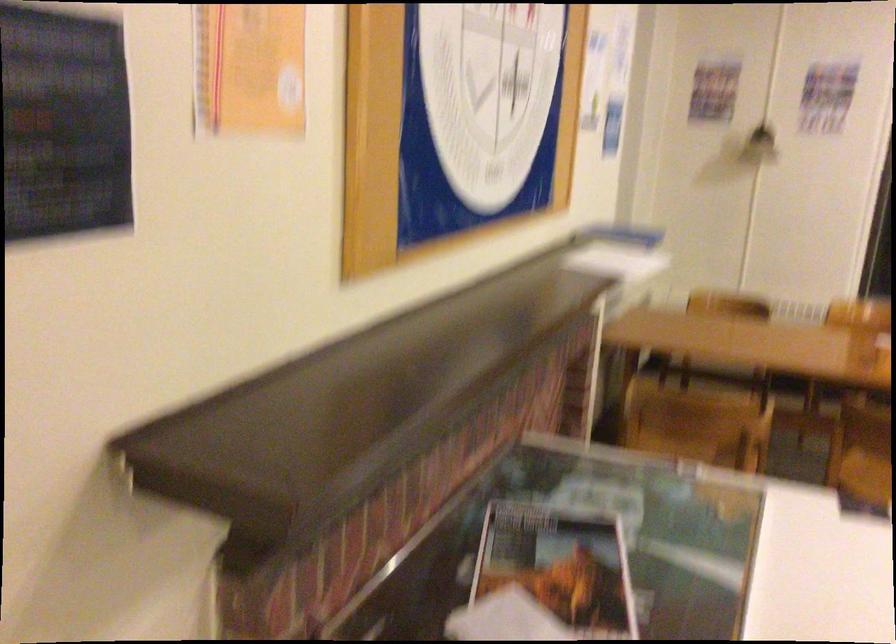
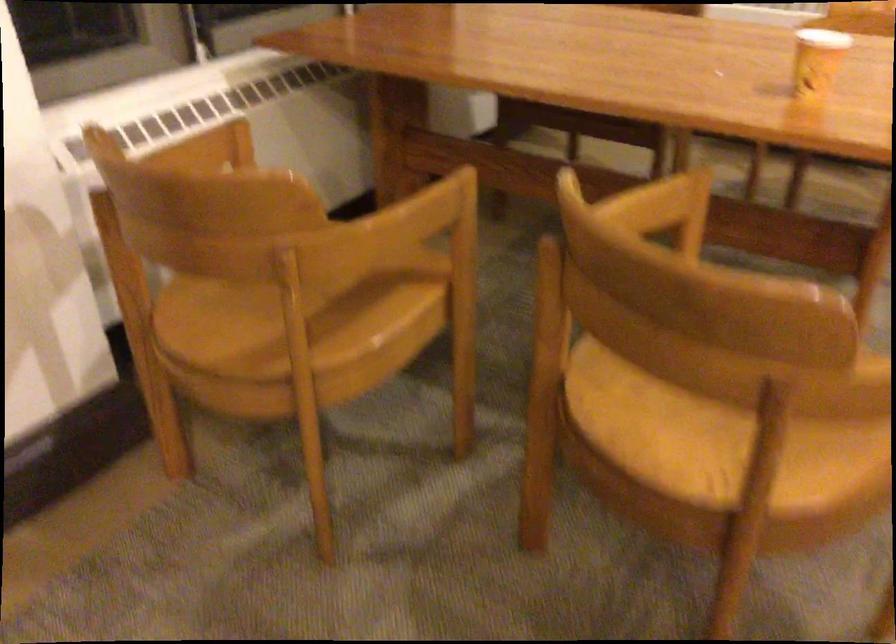
Find the pixel in the second image that matches [673,453] in the first image.

(304, 297)